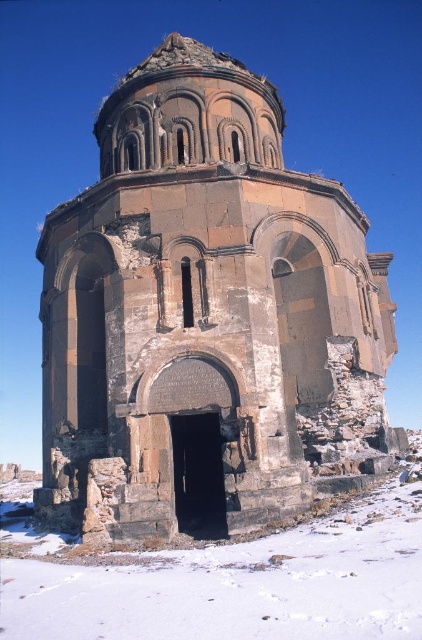
You are an archaeologist examining the ruins of a stone church at center and the white powdery snow at lower center. Which object covers a larger area in the image?

The white powdery snow at lower center covers a larger area than the stone church at center because the stone church at center occupies less space than white powdery snow at lower center.

You are an archaeologist standing 10 feet away from the stone church at center. You want to walk to the white powdery snow at lower center. How many total feet will you have to walk to reach the snow?

The stone church at center is 43.08 feet away from the white powdery snow at lower center. Since you are already 10 feet away from the stone church at center, you will need to walk an additional 33.08 feet to reach the white powdery snow at lower center. Total distance walked would be 43.08 feet.

You are standing in the snowy landscape and want to take a photo of the stone church at center. To ensure the church is perfectly centered in your photo, where should you aim your camera?

The stone church at center is located at point 2D coordinates (205,317), so you should aim your camera at those coordinates to center it in your photo.